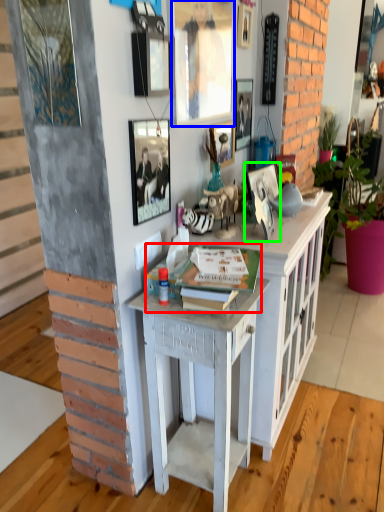
Question: Estimate the real-world distances between objects in this image. Which object is closer to book (highlighted by a red box), picture frame (highlighted by a blue box) or picture frame (highlighted by a green box)?

Choices:
 (A) picture frame
 (B) picture frame

Answer: (B)